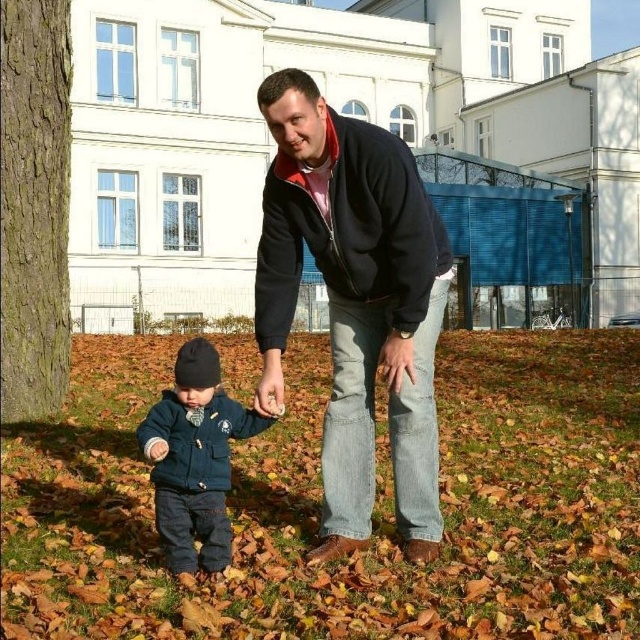
You are a delivery person holding a package that requires a 30 inch clearance to pass through a narrow path between two objects. You see the matte black jacket at center and the dark blue fleece sweatshirt at center. Can you pass through the space between them with the package?

The matte black jacket at center is 25.92 inches away from the dark blue fleece sweatshirt at center. Since the required clearance is 30 inches, the 25.92 inch space is narrower than needed. Therefore, you cannot pass through the space between them with the package.

Based on the coordinates provided, what object is located at point (349, 230) in the scene?

The point (349, 230) corresponds to the dark blue fleece sweatshirt at center.